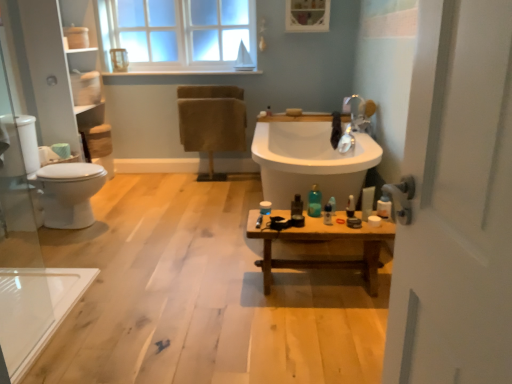
The height and width of the screenshot is (384, 512). I want to click on vacant area located to the right-hand side of white glossy toilet at left, so click(139, 221).